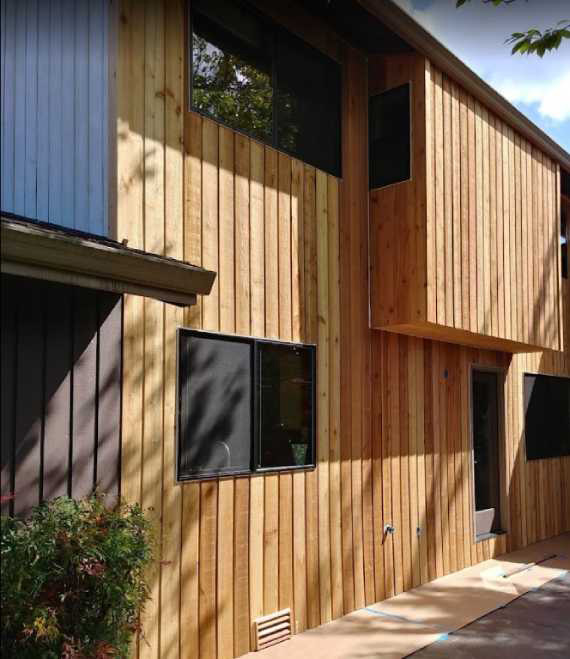
I want to click on paint, so click(x=447, y=640).